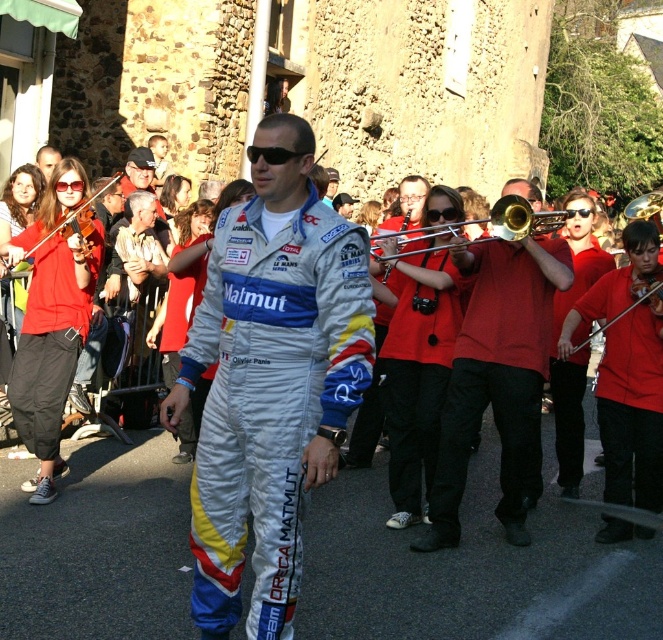
You are a photographer trying to capture the man in the white fabric racing suit at center. The camera you are using has a focus point at coordinate point (271, 380). Will this focus point help you capture the man in the white fabric racing suit at center clearly?

The white fabric racing suit at center is located at point (271, 380), so yes, the focus point at coordinate point (271, 380) will help capture the man in the white fabric racing suit at center clearly.

You are a sound technician setting up a microphone stand for a live performance. The gold brass trumpet at center and the matte black violin at left are both part of the ensemble. The stand can only extend up to 8 meters. Can you place the stand between them without exceeding its maximum reach?

The gold brass trumpet at center is 9.02 meters from the matte black violin at left. Since the microphone stand can only extend up to 8 meters, it cannot reach the required distance between the gold brass trumpet at center and the matte black violin at left.

You are a performer in the parade and need to choose an instrument that is easier to carry. Based on their sizes, which one between the gold brass trombone at center and the gold brass trumpet at upper right would you choose?

The gold brass trombone at center is thinner than the gold brass trumpet at upper right, so it would be easier to carry.